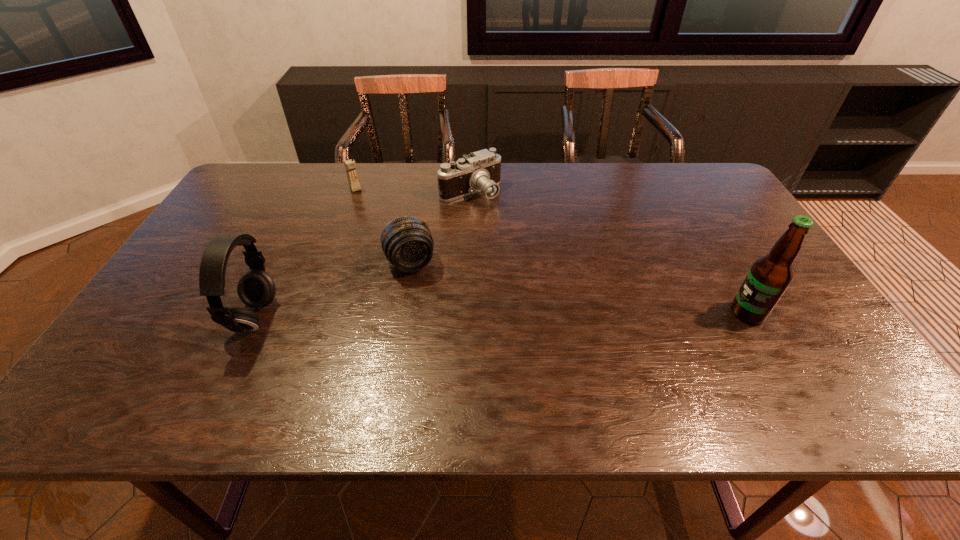
You are a GUI agent. You are given a task and a screenshot of the screen. Output one action in this format:
    pyautogui.click(x=<x>, y=<y>)
    Task: Click on the earphone
    The image size is (960, 540).
    Given the screenshot: What is the action you would take?
    pyautogui.click(x=256, y=289)

In order to click on the second tallest object in this screenshot , I will do `click(256, 289)`.

I want to click on beer bottle, so point(769,277).

You are a GUI agent. You are given a task and a screenshot of the screen. Output one action in this format:
    pyautogui.click(x=<x>, y=<y>)
    Task: Click on the rightmost object
    
    Given the screenshot: What is the action you would take?
    pyautogui.click(x=769, y=277)

This screenshot has width=960, height=540. I want to click on cellular telephone, so click(350, 166).

Locate an element on the screen. Image resolution: width=960 pixels, height=540 pixels. the third shortest object is located at coordinates (350, 166).

The image size is (960, 540). Find the location of `telephoto lens`. telephoto lens is located at coordinates (407, 242).

The height and width of the screenshot is (540, 960). Identify the location of camera. (479, 171).

Where is `vacant area located 0.120m on the ear cups of the fourth shortest object`? The image size is (960, 540). vacant area located 0.120m on the ear cups of the fourth shortest object is located at coordinates (188, 317).

Find the location of a particular element. The width and height of the screenshot is (960, 540). vacant space located 0.230m on the ear cups of the fourth shortest object is located at coordinates (142, 317).